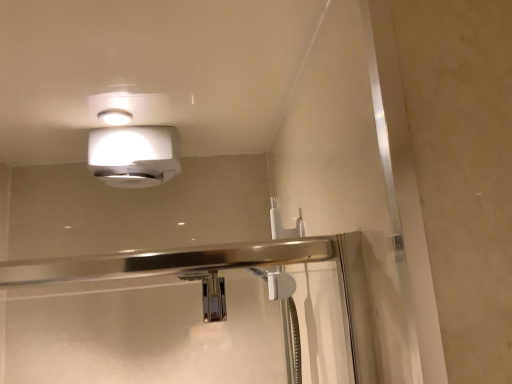
What is the approximate height of white glossy lamp at upper center?

The height of white glossy lamp at upper center is 5.67 inches.

Where is `white glossy lamp at upper center`? The height and width of the screenshot is (384, 512). white glossy lamp at upper center is located at coordinates (134, 155).

Describe the element at coordinates (134, 155) in the screenshot. I see `white glossy lamp at upper center` at that location.

Measure the distance between point (173, 147) and camera.

Point (173, 147) and camera are 3.81 feet apart from each other.

Where is `white glossy lamp at upper center`? This screenshot has width=512, height=384. white glossy lamp at upper center is located at coordinates (134, 155).